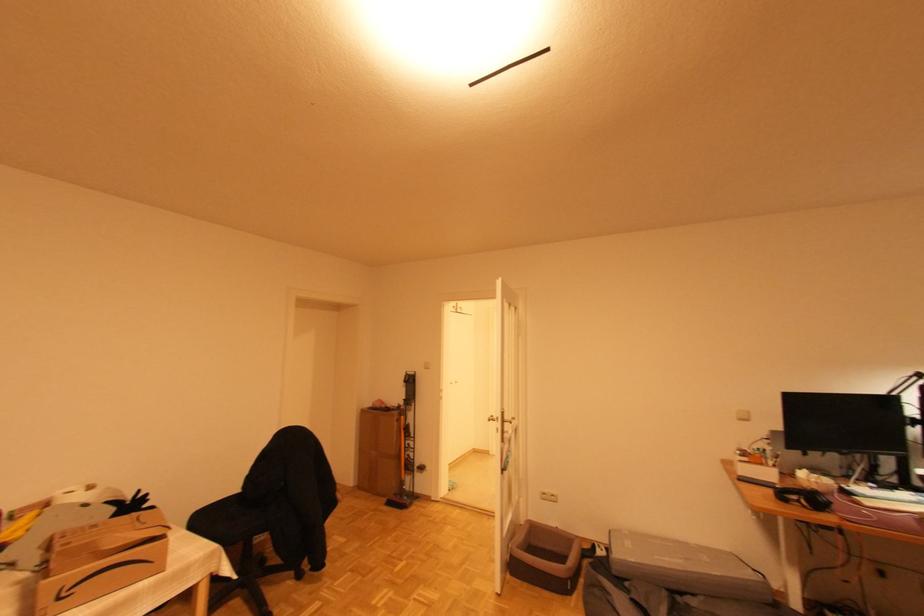
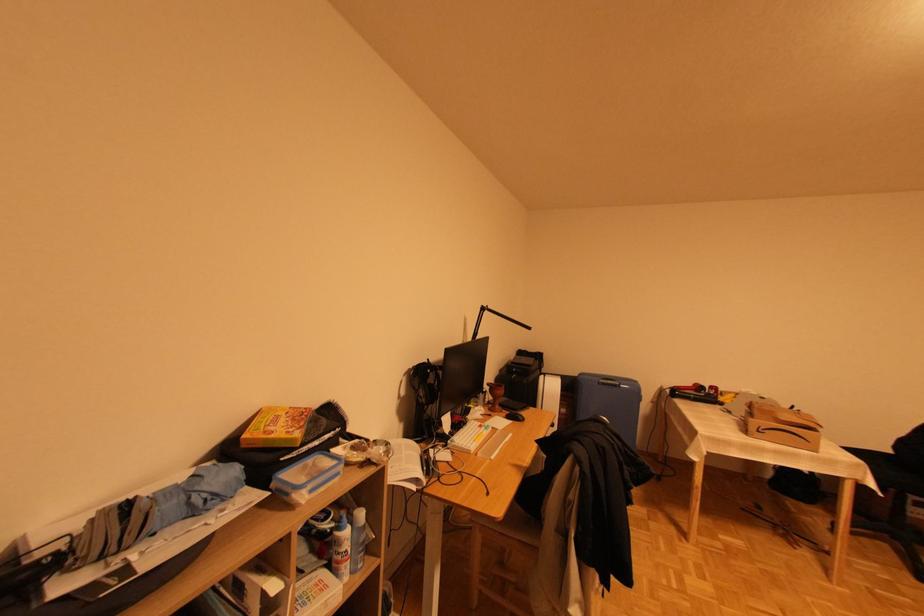
Question: How did the camera likely rotate?

Choices:
 (A) Left
 (B) Right
 (C) Up
 (D) Down

Answer: (A)